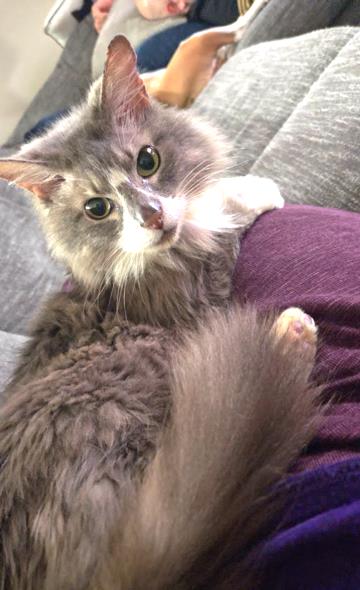
Image resolution: width=360 pixels, height=590 pixels. What are the coordinates of `white fur` in the screenshot? It's located at (134, 238), (174, 209), (211, 205), (261, 192), (285, 321).